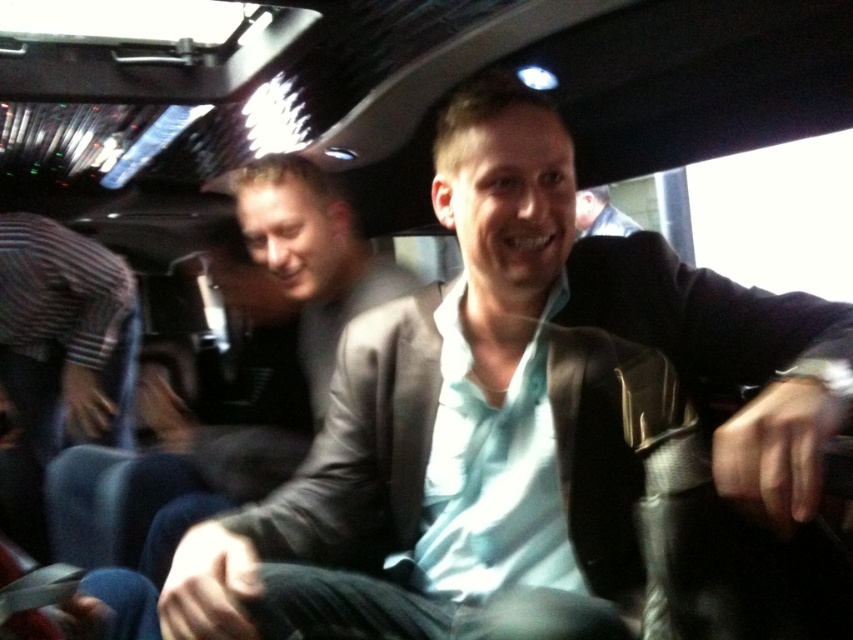
This screenshot has width=853, height=640. Describe the element at coordinates (59, 356) in the screenshot. I see `striped fabric shirt at lower left` at that location.

Can you confirm if striped fabric shirt at lower left is bigger than light blue shirt at center?

Correct, striped fabric shirt at lower left is larger in size than light blue shirt at center.

Is point (61, 448) positioned after point (585, 234)?

No, it is in front of (585, 234).

The width and height of the screenshot is (853, 640). Find the location of `striped fabric shirt at lower left`. striped fabric shirt at lower left is located at coordinates (59, 356).